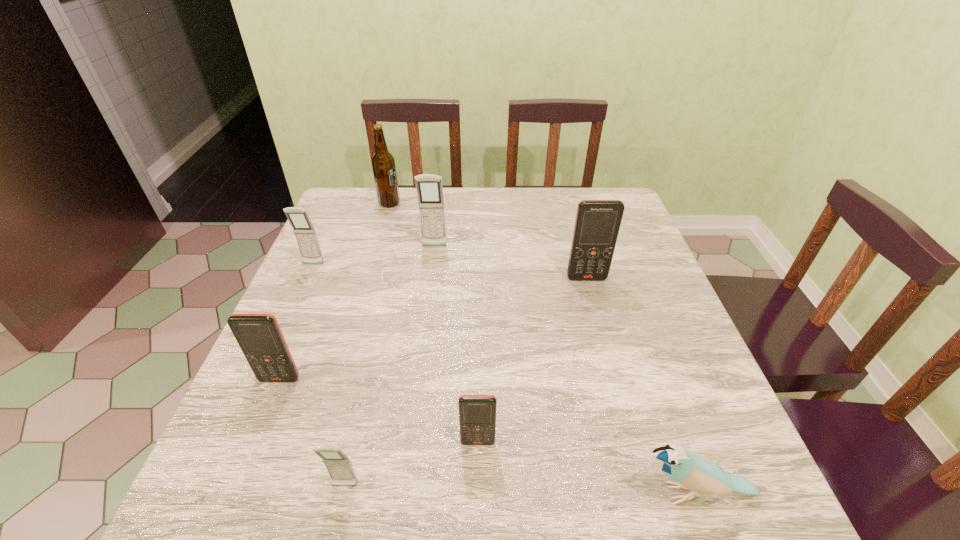
At what (x,y) coordinates should I click in order to perform the action: click on free space located at the face of the blue bird. Please return your answer as a coordinate pair (x, y). The image size is (960, 540). Looking at the image, I should click on (502, 494).

Identify the location of vacant space situated at the face of the blue bird. Image resolution: width=960 pixels, height=540 pixels. (452, 494).

What are the coordinates of `free space located 0.260m at the face of the blue bird` in the screenshot? It's located at (470, 494).

Image resolution: width=960 pixels, height=540 pixels. Find the location of `object that is at the far edge`. object that is at the far edge is located at coordinates pyautogui.click(x=383, y=163).

Where is `bird located in the near edge section of the desktop`? This screenshot has width=960, height=540. bird located in the near edge section of the desktop is located at coordinates (687, 470).

Find the location of `cellular telephone that is at the near edge`. cellular telephone that is at the near edge is located at coordinates (338, 465).

Where is `beer bottle at the left edge`? This screenshot has height=540, width=960. beer bottle at the left edge is located at coordinates (383, 163).

Find the location of a particular element. The image size is (960, 540). cellular telephone located in the right edge section of the desktop is located at coordinates (597, 223).

I want to click on bird that is at the right edge, so [687, 470].

This screenshot has width=960, height=540. In order to click on object that is at the far left corner in this screenshot , I will do `click(383, 163)`.